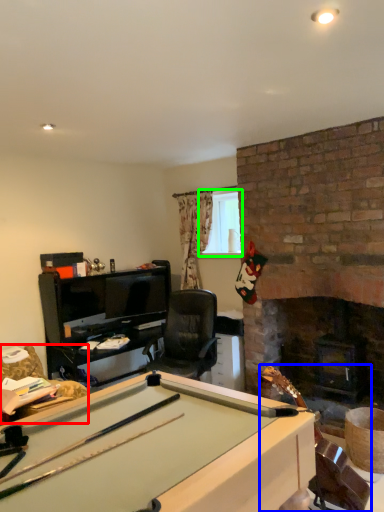
Question: Estimate the real-world distances between objects in this image. Which object is farther from swivel chair (highlighted by a red box), equipment (highlighted by a blue box) or window screen (highlighted by a green box)?

Choices:
 (A) equipment
 (B) window screen

Answer: (A)